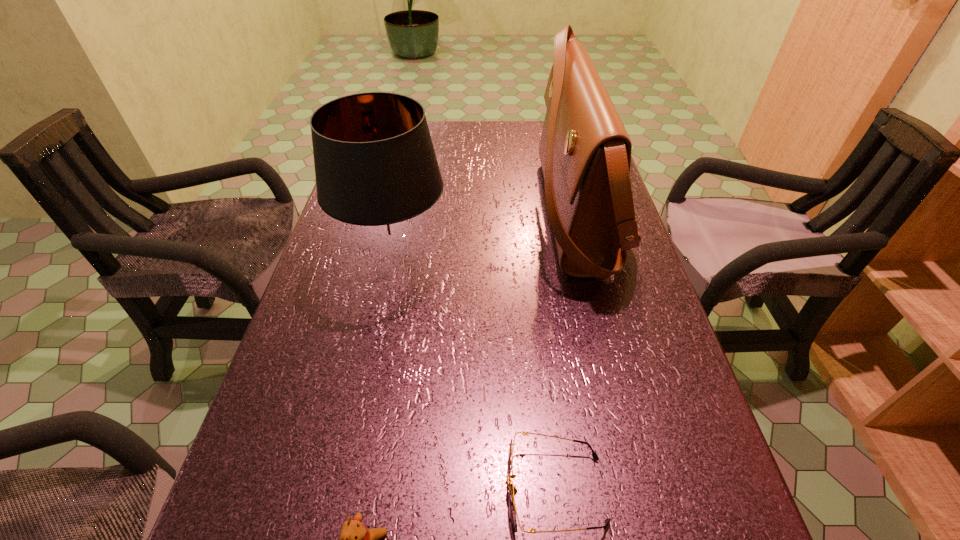
The image size is (960, 540). Find the location of `vacant space at the right edge of the desktop`. vacant space at the right edge of the desktop is located at coordinates (734, 510).

This screenshot has height=540, width=960. Find the location of `empty location between the lampshade and the satchel`. empty location between the lampshade and the satchel is located at coordinates (486, 240).

Where is `unoccupied area between the lampshade and the satchel`? This screenshot has width=960, height=540. unoccupied area between the lampshade and the satchel is located at coordinates click(486, 240).

What are the coordinates of `object that is the closest to the sunglasses` in the screenshot? It's located at (356, 539).

Identify which object is the nearest to the lampshade. Please provide its 2D coordinates. Your answer should be formatted as a tuple, i.e. [(x, y)], where the tuple contains the x and y coordinates of a point satisfying the conditions above.

[(585, 152)]